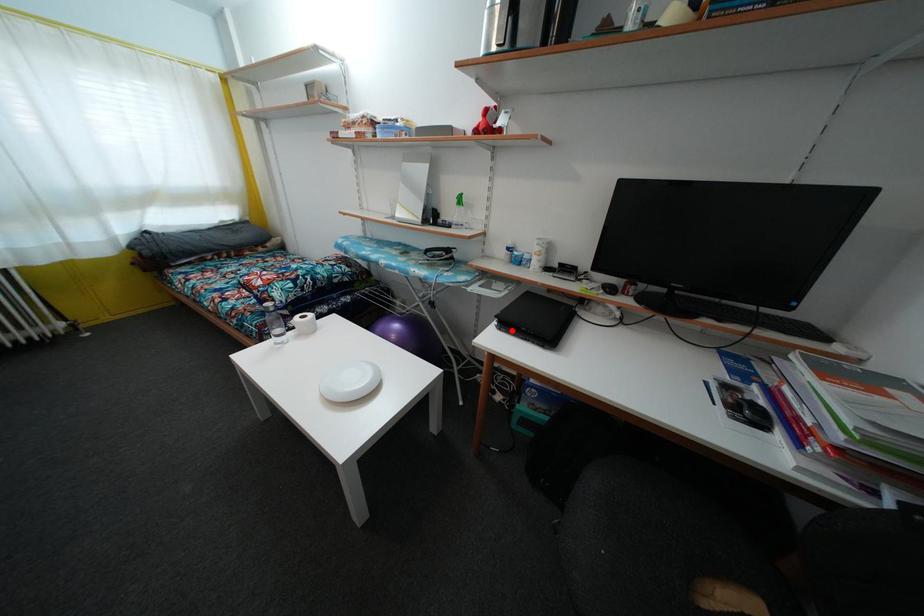
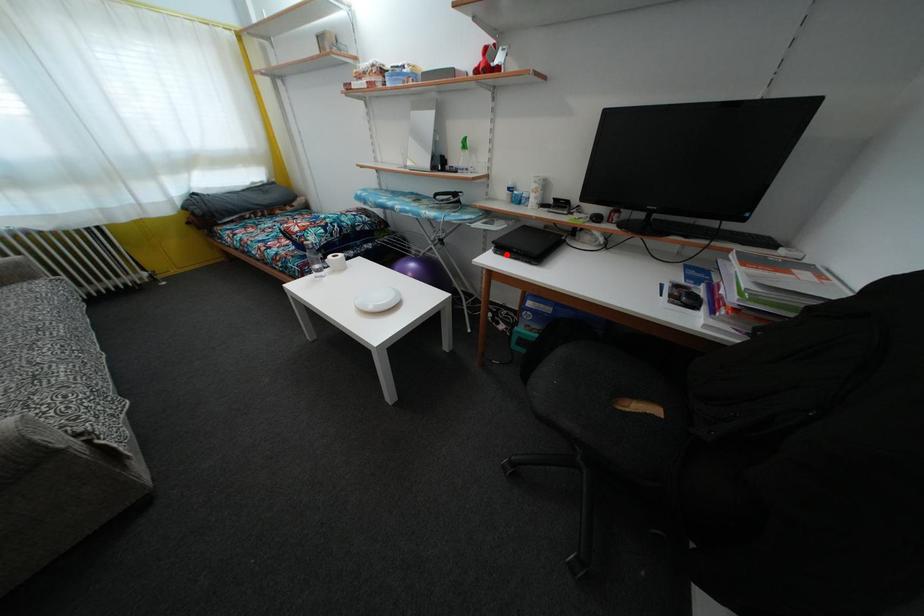
I am providing you with two images of the same scene from different viewpoints. A red point is marked on the first image and another point is marked on the second image. Is the red point in image1 aligned with the point shown in image2?

Yes